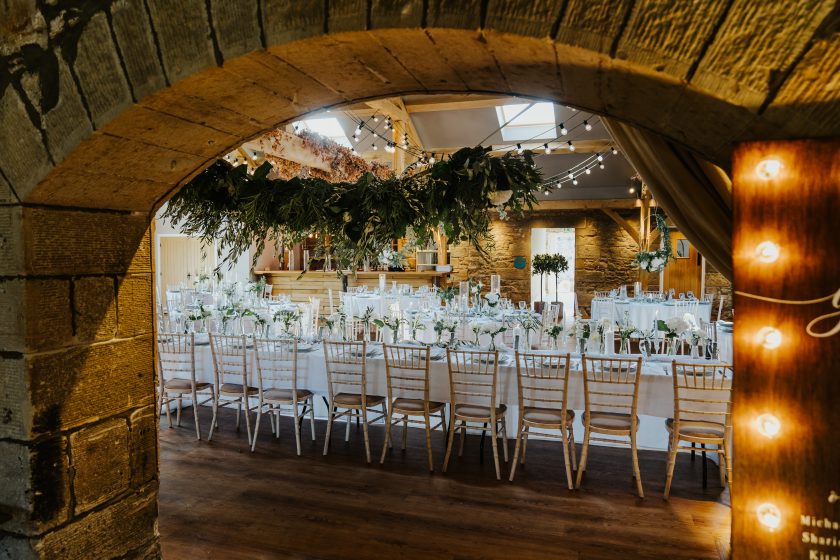
Locate an element on the screen. chairs is located at coordinates click(x=548, y=400).